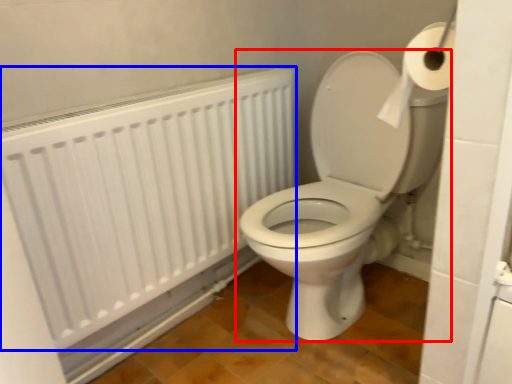
Question: Which object appears farthest to the camera in this image, toilet (highlighted by a red box) or radiator (highlighted by a blue box)?

Choices:
 (A) toilet
 (B) radiator

Answer: (B)